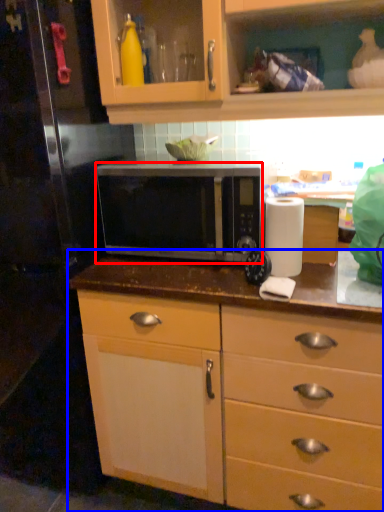
Question: Which object is closer to the camera taking this photo, microwave oven (highlighted by a red box) or countertop (highlighted by a blue box)?

Choices:
 (A) microwave oven
 (B) countertop

Answer: (B)